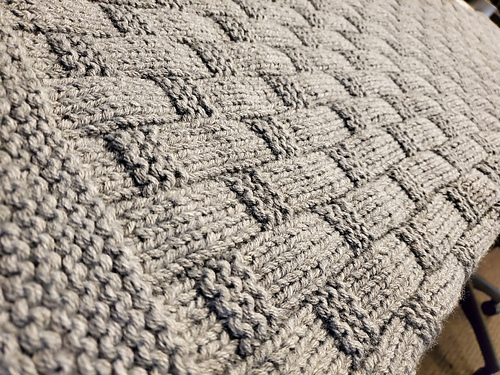
Where is `swivel chair wheels`? This screenshot has width=500, height=375. swivel chair wheels is located at coordinates (490, 314), (482, 370).